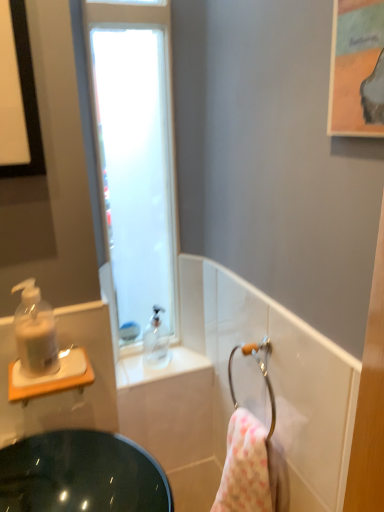
Question: Is point (110, 508) closer or farther from the camera than point (157, 336)?

Choices:
 (A) farther
 (B) closer

Answer: (B)

Question: Is translucent plastic sink at left wider or thinner than transparent plastic soap dispenser at upper center, the 2th soap dispenser viewed from the left?

Choices:
 (A) thin
 (B) wide

Answer: (A)

Question: Based on their relative distances, which object is farther from the translucent plastic sink at left?

Choices:
 (A) translucent plastic soap dispenser at left, which is the first soap dispenser in front-to-back order
 (B) frosted glass window at upper left
 (C) transparent plastic soap dispenser at upper center, which appears as the second soap dispenser when viewed from the front
 (D) white textured towel at lower right

Answer: (B)

Question: Estimate the real-world distances between objects in this image. Which object is farther from the translucent plastic soap dispenser at left, positioned as the 2th soap dispenser in right-to-left order?

Choices:
 (A) white textured towel at lower right
 (B) translucent plastic sink at left
 (C) frosted glass window at upper left
 (D) transparent plastic soap dispenser at upper center, the 2th soap dispenser viewed from the left

Answer: (D)